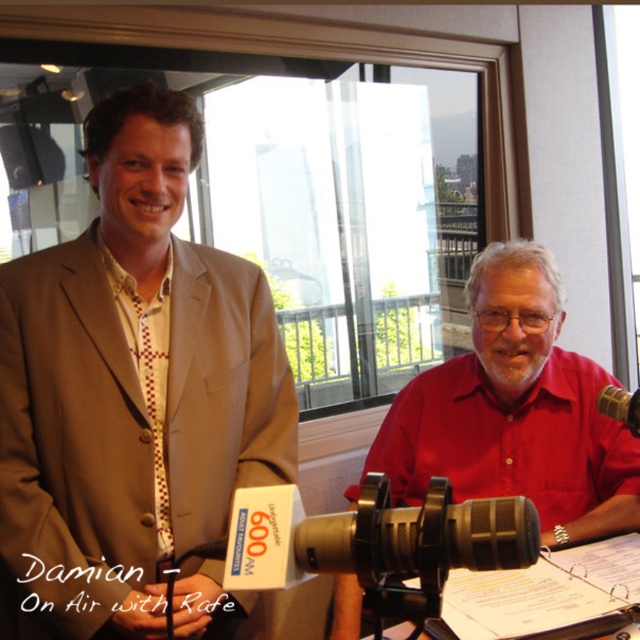
Question: Which of the following is the closest to the observer?

Choices:
 (A) (529, 614)
 (B) (502, 275)

Answer: (A)

Question: Based on their relative distances, which object is farther from the black plastic microphone at lower center?

Choices:
 (A) matte beige suit at center
 (B) red matte shirt at center

Answer: (A)

Question: Which of the following is the closest to the observer?

Choices:
 (A) (404, 611)
 (B) (637, 602)

Answer: (A)

Question: Can you confirm if matte beige suit at center is positioned to the left of black plastic microphone at lower center?

Choices:
 (A) no
 (B) yes

Answer: (B)

Question: Observing the image, what is the correct spatial positioning of matte beige suit at center in reference to black plastic microphone at lower center?

Choices:
 (A) below
 (B) above

Answer: (B)

Question: Is the position of matte beige suit at center less distant than that of black matte microphone at lower center?

Choices:
 (A) yes
 (B) no

Answer: (B)